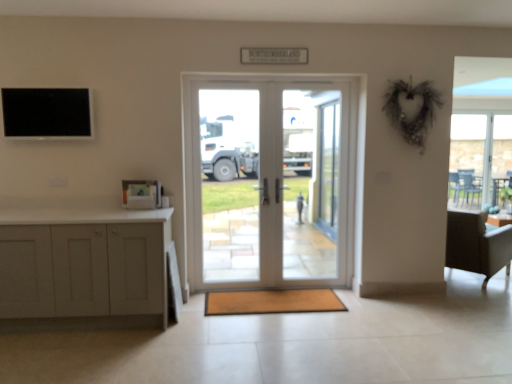
The height and width of the screenshot is (384, 512). Describe the element at coordinates (83, 266) in the screenshot. I see `white matte cabinet at left` at that location.

The height and width of the screenshot is (384, 512). Find the location of `white matte cabinet at left`. white matte cabinet at left is located at coordinates tap(83, 266).

I want to click on transparent glass table at right, so click(x=478, y=155).

The width and height of the screenshot is (512, 384). What do you see at coordinates (328, 168) in the screenshot? I see `clear glass screen door at center, which ranks as the 2th screen door in left-to-right order` at bounding box center [328, 168].

What is the approximate width of white glass door at center?

white glass door at center is 3.64 inches wide.

Where is `white matte cabinet at left`? This screenshot has height=384, width=512. white matte cabinet at left is located at coordinates (83, 266).

From the image's perspective, is white matte cabinet at left on black matte screen at upper left?

Actually, white matte cabinet at left appears below black matte screen at upper left in the image.

Which of these two, white matte cabinet at left or black matte screen at upper left, stands shorter?

Standing shorter between the two is black matte screen at upper left.

Considering the sizes of objects white matte cabinet at left and black matte screen at upper left in the image provided, who is smaller, white matte cabinet at left or black matte screen at upper left?

With smaller size is black matte screen at upper left.

Could you tell me if white matte cabinet at left is facing black matte screen at upper left?

No, white matte cabinet at left does not turn towards black matte screen at upper left.

Does transparent glass table at right contain transparent glass door at center, arranged as the 1th screen door when viewed from the front?

No, transparent glass door at center, arranged as the 1th screen door when viewed from the front, is not surrounded by transparent glass table at right.

Is transparent glass table at right in front of or behind transparent glass door at center, arranged as the second screen door when viewed from the back, in the image?

Visually, transparent glass table at right is located behind transparent glass door at center, arranged as the second screen door when viewed from the back.

From a real-world perspective, is transparent glass table at right physically below transparent glass door at center, the first screen door in the left-to-right sequence?

Actually, transparent glass table at right is physically above transparent glass door at center, the first screen door in the left-to-right sequence, in the real world.

How many degrees apart are the facing directions of transparent glass table at right and transparent glass door at center, arranged as the 1th screen door when viewed from the front?

The facing directions of transparent glass table at right and transparent glass door at center, arranged as the 1th screen door when viewed from the front, are 0.239 degrees apart.

Is point (496, 256) positioned in front of point (465, 157)?

Yes, point (496, 256) is closer to viewer.

Considering the sizes of objects light gray fabric chair at right and transparent glass table at right in the image provided, who is wider, light gray fabric chair at right or transparent glass table at right?

With larger width is light gray fabric chair at right.

What's the angular difference between light gray fabric chair at right and transparent glass table at right's facing directions?

The facing directions of light gray fabric chair at right and transparent glass table at right are 126 degrees apart.

From a real-world perspective, is light gray fabric chair at right located higher than transparent glass table at right?

Incorrect, from a real-world perspective, light gray fabric chair at right is lower than transparent glass table at right.

Can we say brown textured mat at center lies outside transparent glass door at center, the first screen door in the left-to-right sequence?

Yes, brown textured mat at center is not within transparent glass door at center, the first screen door in the left-to-right sequence.

Find the location of a particular element. This screenshot has width=512, height=384. doormat below the transparent glass door at center, arranged as the second screen door when viewed from the back (from the image's perspective) is located at coordinates (272, 301).

Considering the sizes of objects brown textured mat at center and transparent glass door at center, the first screen door in the left-to-right sequence, in the image provided, who is wider, brown textured mat at center or transparent glass door at center, the first screen door in the left-to-right sequence,?

brown textured mat at center is wider.

What's the angular difference between brown textured mat at center and transparent glass door at center, which ranks as the 2th screen door in right-to-left order,'s facing directions?

They differ by 0.448 degrees in their facing directions.

Can you confirm if clear glass screen door at center, which is the 1th screen door in right-to-left order, is positioned to the right of light gray fabric chair at right?

No.

Consider the image. Who is taller, clear glass screen door at center, which is the 1th screen door in right-to-left order, or light gray fabric chair at right?

clear glass screen door at center, which is the 1th screen door in right-to-left order, is taller.

Does clear glass screen door at center, the first screen door from the back, turn towards light gray fabric chair at right?

No, clear glass screen door at center, the first screen door from the back, is not facing towards light gray fabric chair at right.

From the image's perspective, is clear glass screen door at center, the first screen door from the back, positioned above or below light gray fabric chair at right?

Based on their image positions, clear glass screen door at center, the first screen door from the back, is located above light gray fabric chair at right.

Is white matte cabinet at left not close to brown textured mat at center?

Yes, white matte cabinet at left is far from brown textured mat at center.

Which of these two, white matte cabinet at left or brown textured mat at center, stands shorter?

brown textured mat at center.

Is white matte cabinet at left to the left of brown textured mat at center from the viewer's perspective?

Yes.

Is white matte cabinet at left oriented away from brown textured mat at center?

No.

What's the angular difference between light gray fabric chair at right and black matte screen at upper left's facing directions?

light gray fabric chair at right and black matte screen at upper left are facing 128 degrees away from each other.

Considering the relative sizes of light gray fabric chair at right and black matte screen at upper left in the image provided, is light gray fabric chair at right bigger than black matte screen at upper left?

Yes.

Which is behind, point (451, 258) or point (66, 116)?

The point (451, 258) is farther from the camera.

Looking at their sizes, would you say light gray fabric chair at right is wider or thinner than black matte screen at upper left?

light gray fabric chair at right is wider than black matte screen at upper left.

Find the location of `screen above the white matte cabinet at left (from a real-world perspective)`. screen above the white matte cabinet at left (from a real-world perspective) is located at coordinates (46, 112).

The image size is (512, 384). In order to click on screen door that is the 2nd object located in front of the transparent glass table at right in this screenshot , I will do `click(310, 183)`.

From the image, which object appears to be farther from white matte cabinet at left, transparent glass door at center, arranged as the second screen door when viewed from the back, or black matte screen at upper left?

transparent glass door at center, arranged as the second screen door when viewed from the back, is positioned further to the anchor white matte cabinet at left.

Estimate the real-world distances between objects in this image. Which object is closer to light gray fabric chair at right, brown textured mat at center or clear glass screen door at center, which is the 1th screen door in right-to-left order?

brown textured mat at center lies closer to light gray fabric chair at right than the other object.

Based on their spatial positions, is black matte screen at upper left or transparent glass table at right further from white glass door at center?

transparent glass table at right lies further to white glass door at center than the other object.

Considering their positions, is clear glass screen door at center, which is the 1th screen door in right-to-left order, positioned closer to brown textured mat at center than white matte cabinet at left?

white matte cabinet at left is closer to brown textured mat at center.

When comparing their distances from white glass door at center, does light gray fabric chair at right or transparent glass door at center, the first screen door in the left-to-right sequence, seem further?

light gray fabric chair at right is further to white glass door at center.

From the image, which object appears to be nearer to transparent glass door at center, the first screen door in the left-to-right sequence, white matte cabinet at left or transparent glass table at right?

Among the two, white matte cabinet at left is located nearer to transparent glass door at center, the first screen door in the left-to-right sequence.

From the image, which object appears to be nearer to black matte screen at upper left, white glass door at center or white matte cabinet at left?

Based on the image, white matte cabinet at left appears to be nearer to black matte screen at upper left.

Considering their positions, is black matte screen at upper left positioned closer to light gray fabric chair at right than white matte cabinet at left?

white matte cabinet at left is positioned closer to the anchor light gray fabric chair at right.

This screenshot has height=384, width=512. In order to click on door located between white matte cabinet at left and transparent glass door at center, which ranks as the 2th screen door in right-to-left order, in the left-right direction in this screenshot , I will do `click(269, 181)`.

Locate an element on the screen. Image resolution: width=512 pixels, height=384 pixels. doormat between black matte screen at upper left and light gray fabric chair at right is located at coordinates (272, 301).

Where is `door located between white matte cabinet at left and transparent glass table at right in the left-right direction`? Image resolution: width=512 pixels, height=384 pixels. door located between white matte cabinet at left and transparent glass table at right in the left-right direction is located at coordinates (269, 181).

At what (x,y) coordinates should I click in order to perform the action: click on doormat between black matte screen at upper left and clear glass screen door at center, the first screen door from the back, in the front-back direction. Please return your answer as a coordinate pair (x, y). Looking at the image, I should click on (272, 301).